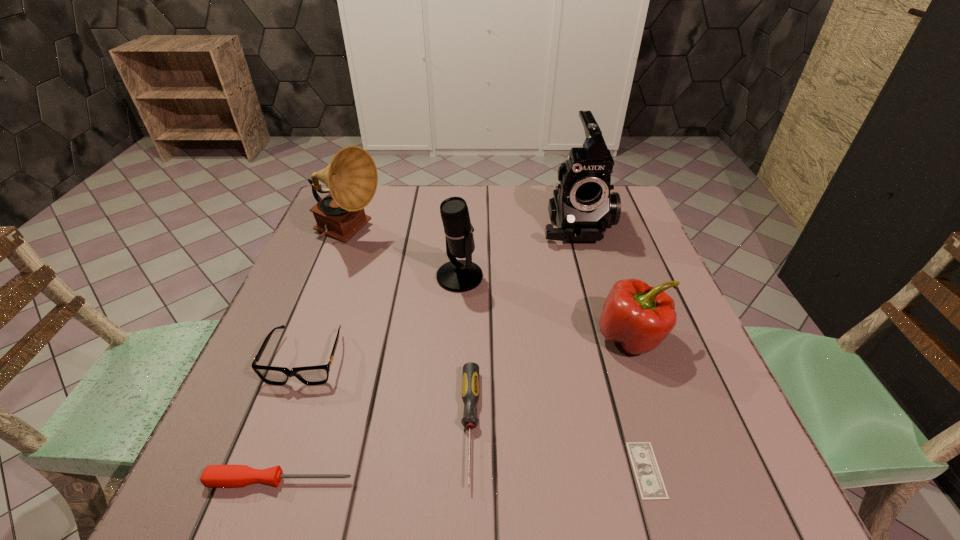
Locate an element on the screen. This screenshot has height=540, width=960. camcorder is located at coordinates (582, 206).

Image resolution: width=960 pixels, height=540 pixels. In order to click on phonograph record in this screenshot , I will do `click(351, 177)`.

The image size is (960, 540). What are the coordinates of `microphone` in the screenshot? It's located at (456, 275).

Find the location of a particular element. The height and width of the screenshot is (540, 960). the third farthest object is located at coordinates (456, 275).

Locate an element on the screen. the fourth tallest object is located at coordinates (639, 317).

Identify the location of sunglasses. (310, 375).

Where is `the right screwdriver`? The width and height of the screenshot is (960, 540). the right screwdriver is located at coordinates (470, 381).

This screenshot has width=960, height=540. Identify the location of the left screwdriver. (215, 476).

Where is `the shorter screwdriver`? The height and width of the screenshot is (540, 960). the shorter screwdriver is located at coordinates (215, 476).

Where is `money`? Image resolution: width=960 pixels, height=540 pixels. money is located at coordinates (650, 483).